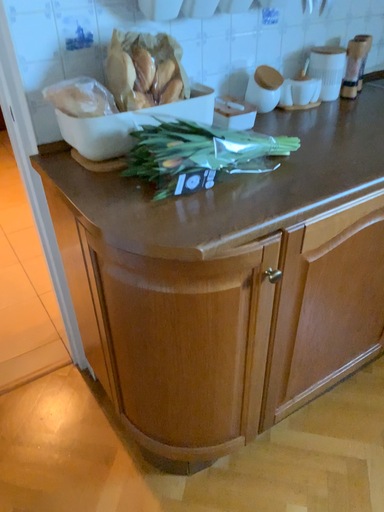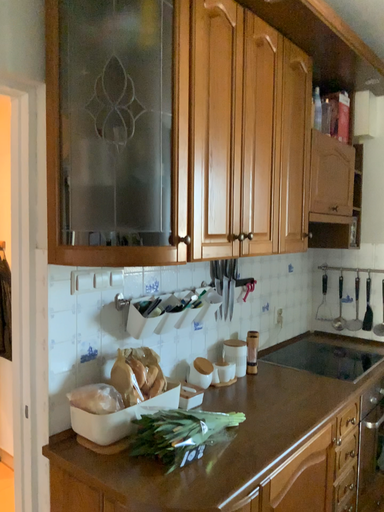
Question: Which way did the camera rotate in the video?

Choices:
 (A) rotated left
 (B) rotated right

Answer: (B)